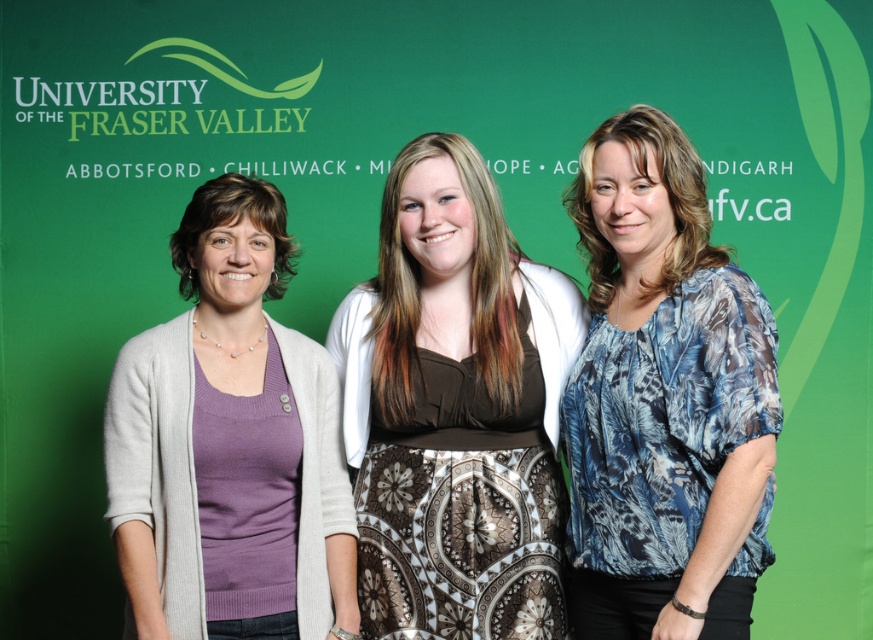
You are a photographer who needs to arrange the models according to their clothing descriptions. The blue printed blouse at center and the purple knit sweater at left are part of the setup. Which model should be placed to the right of the other?

The blue printed blouse at center should be placed to the right of the purple knit sweater at left because the blue printed blouse at center is positioned on the right side of purple knit sweater at left.

You are an event planner organizing a university event and need to ensure proper seating arrangements. Given the coordinates provided for the brown satin dress at center, can you determine its position relative to the backdrop?

The brown satin dress at center is positioned at coordinates 0.641 on the x axis and 0.522 on the y axis relative to the backdrop.